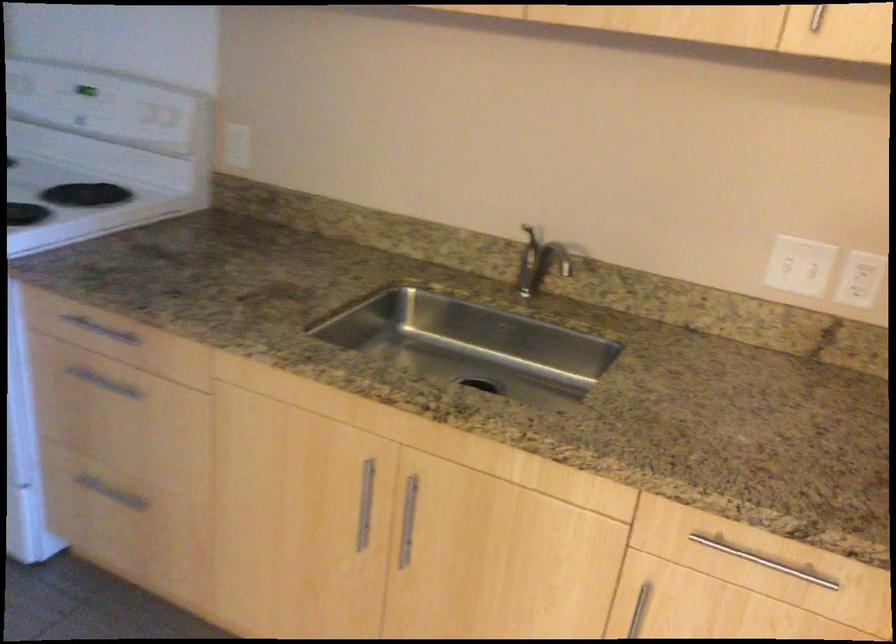
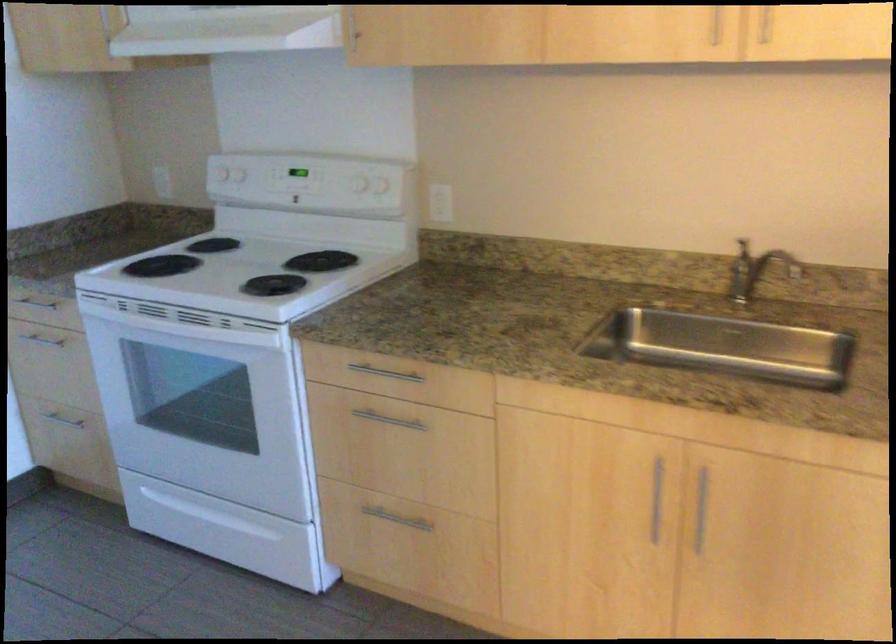
Question: Based on the continuous images, in which direction is the camera rotating? Reply with the corresponding letter.

Choices:
 (A) Left
 (B) Right
 (C) Up
 (D) Down

Answer: (C)